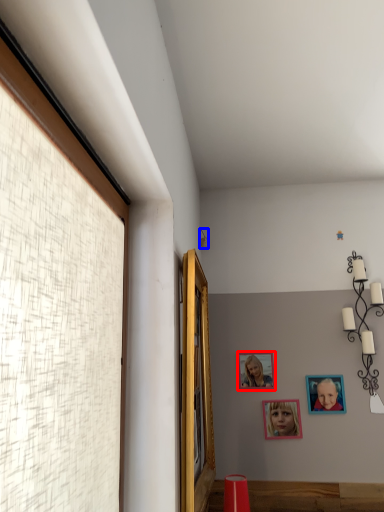
Question: Which object appears closest to the camera in this image, picture frame (highlighted by a red box) or lamp (highlighted by a blue box)?

Choices:
 (A) picture frame
 (B) lamp

Answer: (A)